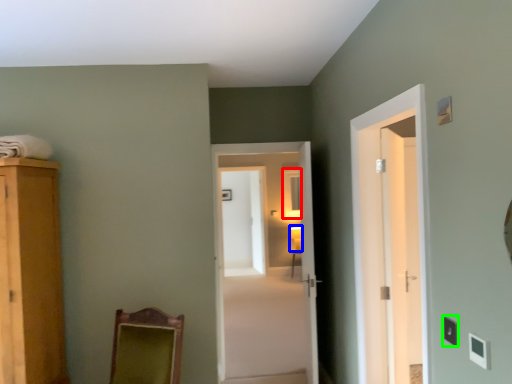
Question: Considering the real-world distances, which object is closest to mirror (highlighted by a red box)? light fixture (highlighted by a blue box) or light switch (highlighted by a green box).

Choices:
 (A) light fixture
 (B) light switch

Answer: (A)